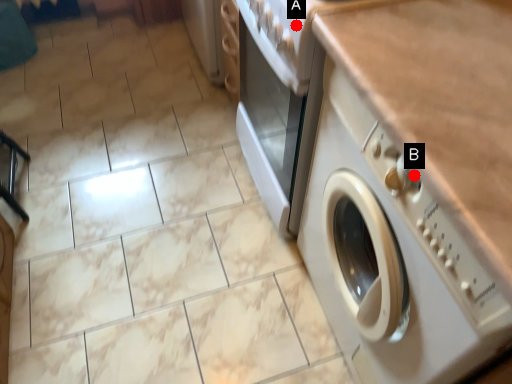
Question: Two points are circled on the image, labeled by A and B beside each circle. Which point is farther to the camera?

Choices:
 (A) A is further
 (B) B is further

Answer: (A)